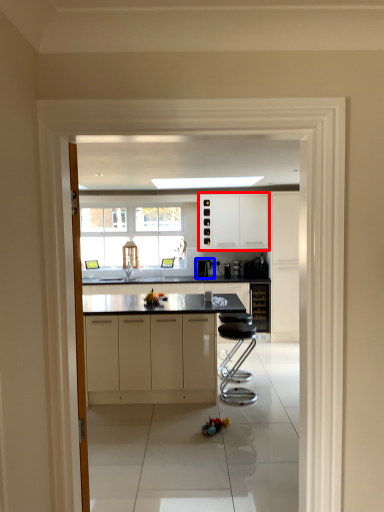
Question: Which point is closer to the camera, cabinetry (highlighted by a red box) or appliance (highlighted by a blue box)?

Choices:
 (A) cabinetry
 (B) appliance

Answer: (A)